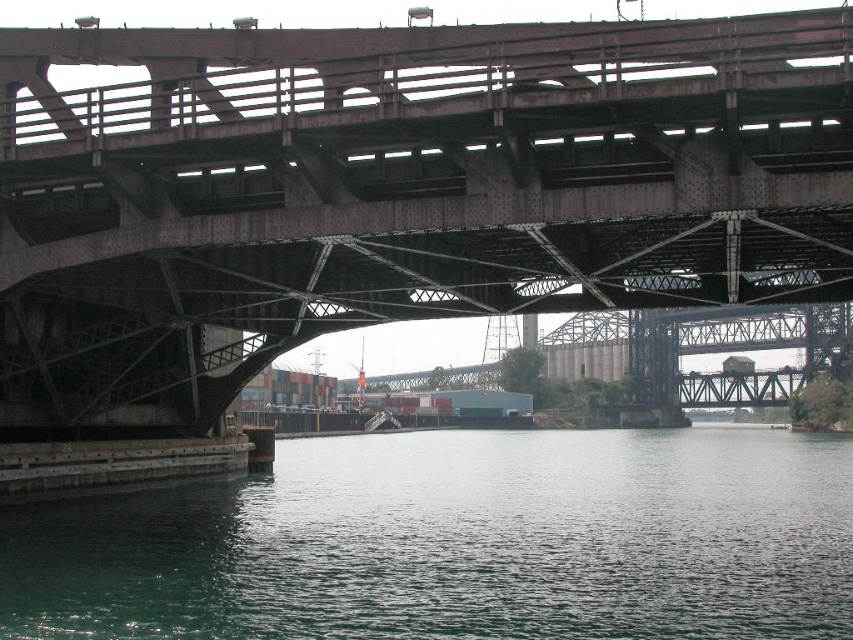
Question: Observing the image, what is the correct spatial positioning of rusty metal bridge at upper center in reference to green water at lower center?

Choices:
 (A) left
 (B) right

Answer: (A)

Question: Which point appears closest to the camera in this image?

Choices:
 (A) (495, 504)
 (B) (704, 60)

Answer: (B)

Question: Does rusty metal bridge at upper center appear on the left side of green water at lower center?

Choices:
 (A) no
 (B) yes

Answer: (B)

Question: Does rusty metal bridge at upper center appear under green water at lower center?

Choices:
 (A) no
 (B) yes

Answer: (A)